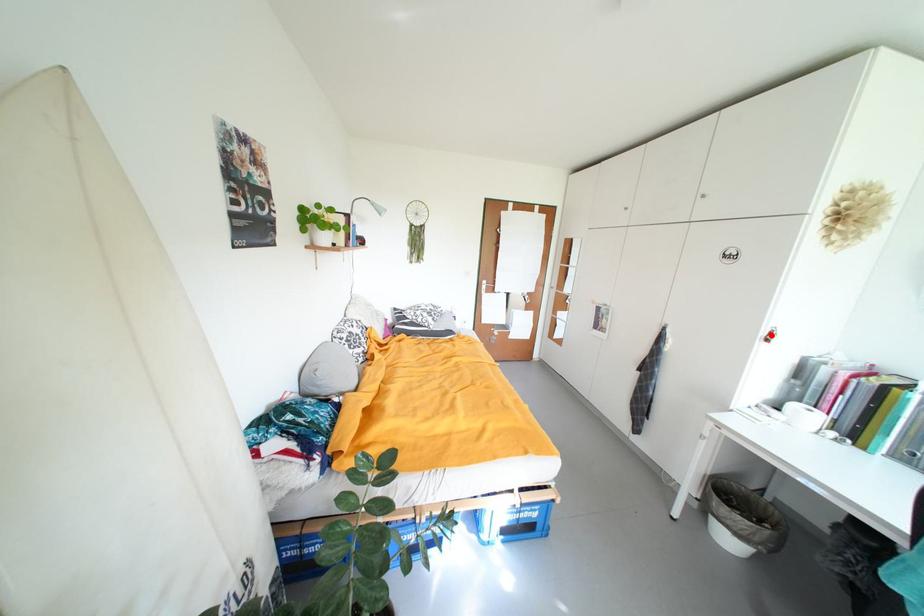
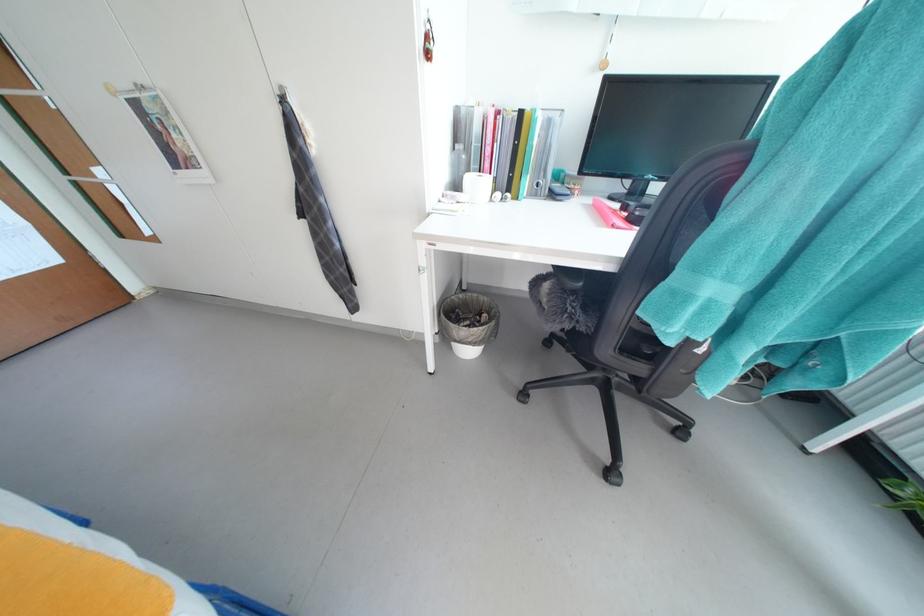
Question: I am providing you with two images of the same scene from different viewpoints. A red point is marked on the first image. Can you still see the location of the red point in image 2?

Choices:
 (A) Yes
 (B) No

Answer: (A)